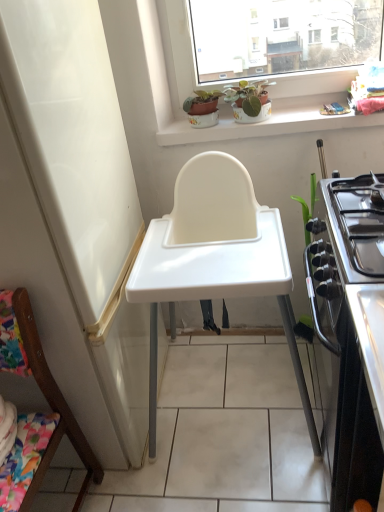
Question: From the image's perspective, is matte ceramic pot at upper center, marked as the 2th houseplant in a right-to-left arrangement, above or below green matte plant at upper center, acting as the 2th houseplant starting from the left?

Choices:
 (A) above
 (B) below

Answer: (A)

Question: From a real-world perspective, relative to green matte plant at upper center, acting as the 2th houseplant starting from the left, is matte ceramic pot at upper center, which ranks as the first houseplant in left-to-right order, vertically above or below?

Choices:
 (A) below
 (B) above

Answer: (A)

Question: Which of these objects is positioned closest to the matte ceramic pot at upper center, which ranks as the first houseplant in left-to-right order?

Choices:
 (A) green matte plant at upper center, marked as the 1th houseplant in a right-to-left arrangement
 (B) wooden chair at lower left
 (C) white ceramic window sill at upper center
 (D) stainless steel stove at right
 (E) white plastic highchair at center

Answer: (A)

Question: Which of these objects is positioned closest to the white ceramic window sill at upper center?

Choices:
 (A) white plastic highchair at center
 (B) wooden chair at lower left
 (C) green matte plant at upper center, acting as the 2th houseplant starting from the left
 (D) matte ceramic pot at upper center, which ranks as the first houseplant in left-to-right order
 (E) stainless steel stove at right

Answer: (C)